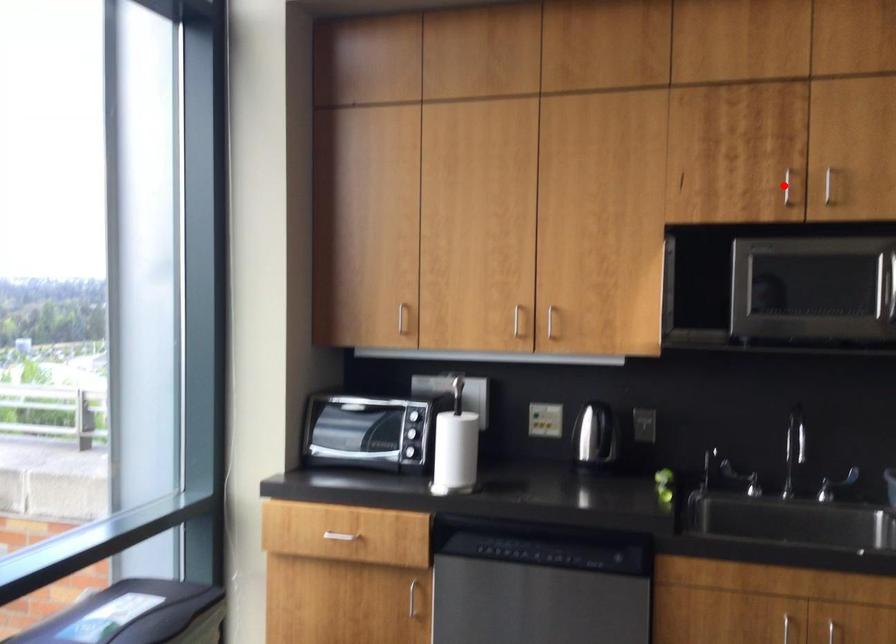
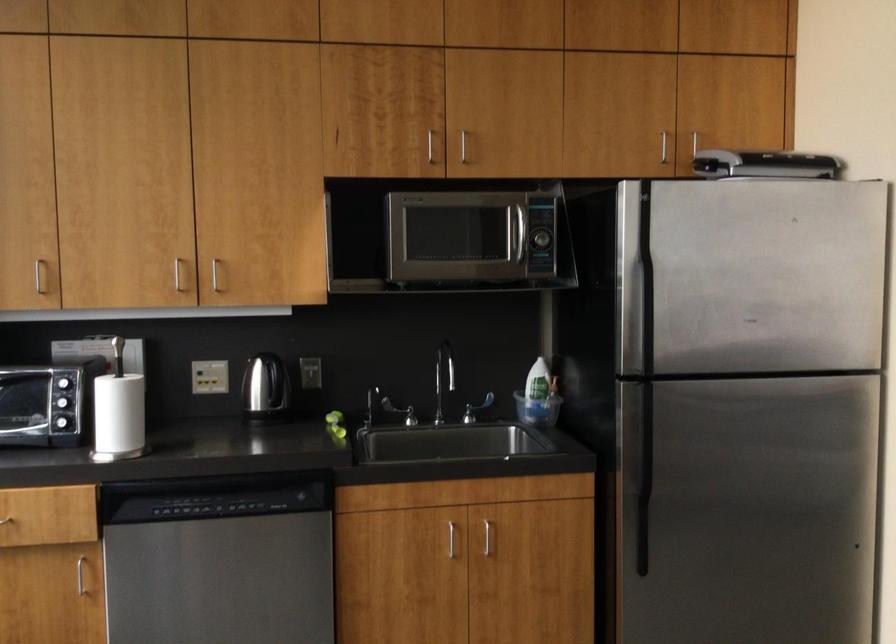
Question: I am providing you with two images of the same scene from different viewpoints. In image1, a red point is highlighted. Considering the same 3D point in image2, which of the following is correct?

Choices:
 (A) It is closer
 (B) It is farther

Answer: (B)